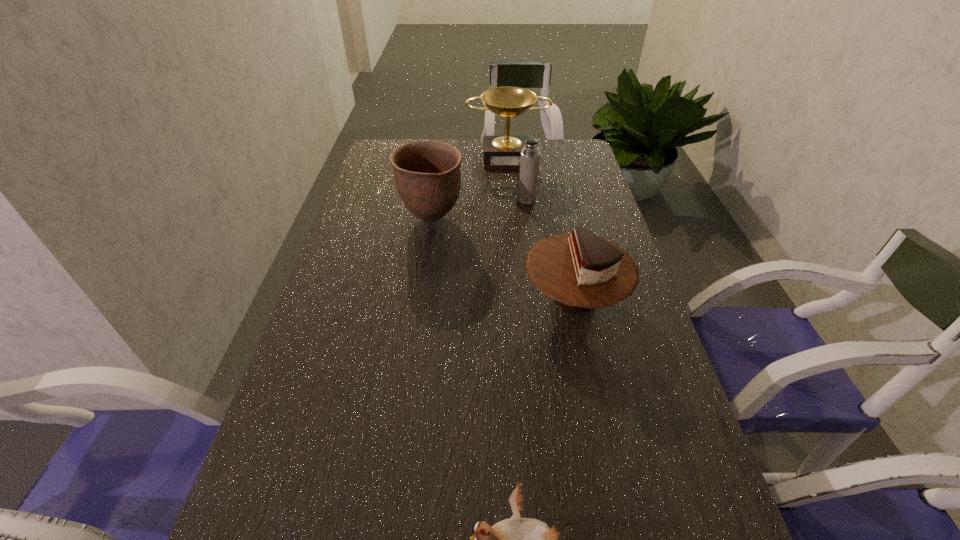
The height and width of the screenshot is (540, 960). Identify the location of award. (500, 152).

The image size is (960, 540). What are the coordinates of `pottery` in the screenshot? It's located at (428, 175).

The height and width of the screenshot is (540, 960). Find the location of `thermos bottle`. thermos bottle is located at coordinates (530, 156).

Locate an element on the screen. Image resolution: width=960 pixels, height=540 pixels. the second nearest object is located at coordinates (580, 271).

The width and height of the screenshot is (960, 540). I want to click on free space located 0.340m on the front-facing side of the farthest object, so click(513, 224).

Where is `vacant region located 0.080m on the right of the pottery`? The width and height of the screenshot is (960, 540). vacant region located 0.080m on the right of the pottery is located at coordinates click(490, 218).

Find the location of `vacant region located on the back of the thermos bottle`. vacant region located on the back of the thermos bottle is located at coordinates (524, 179).

Where is `free space located on the left of the cake`? Image resolution: width=960 pixels, height=540 pixels. free space located on the left of the cake is located at coordinates (428, 297).

Image resolution: width=960 pixels, height=540 pixels. I want to click on object located in the far edge section of the desktop, so click(x=500, y=152).

The width and height of the screenshot is (960, 540). What are the coordinates of `object that is at the left edge` in the screenshot? It's located at pos(428,175).